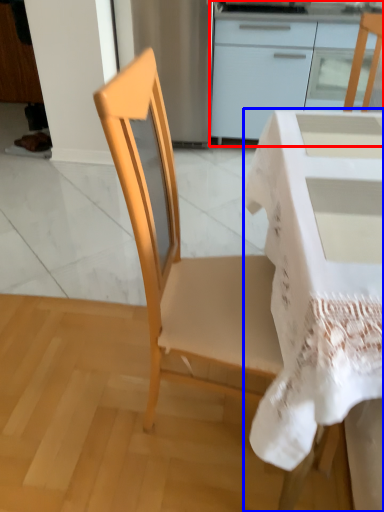
Question: Which of the following is the closest to the observer, cabinetry (highlighted by a red box) or desk (highlighted by a blue box)?

Choices:
 (A) cabinetry
 (B) desk

Answer: (B)